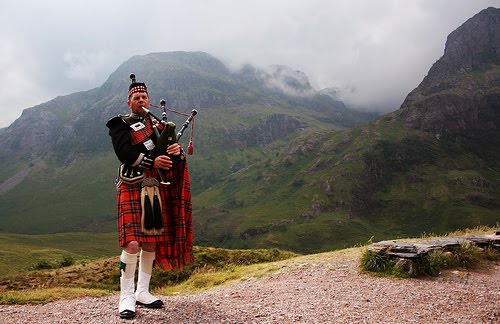
At what (x,y) coordinates should I click in order to perform the action: click on tassel. Please return your answer as a coordinate pair (x, y). The image size is (500, 324). Looking at the image, I should click on [190, 146].